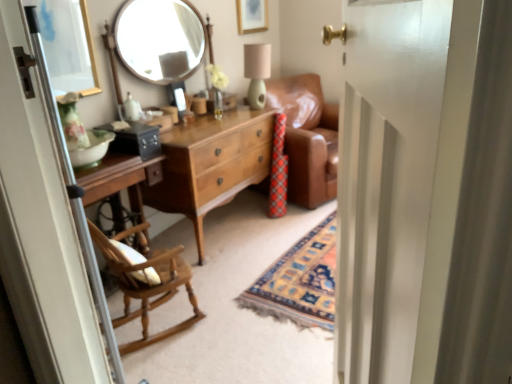
You are a GUI agent. You are given a task and a screenshot of the screen. Output one action in this format:
    pyautogui.click(x=<x>, y=<y>)
    Task: Click on the vacant region in front of wooden rocking chair at left
    The image size is (512, 384).
    Given the screenshot: What is the action you would take?
    pyautogui.click(x=167, y=365)